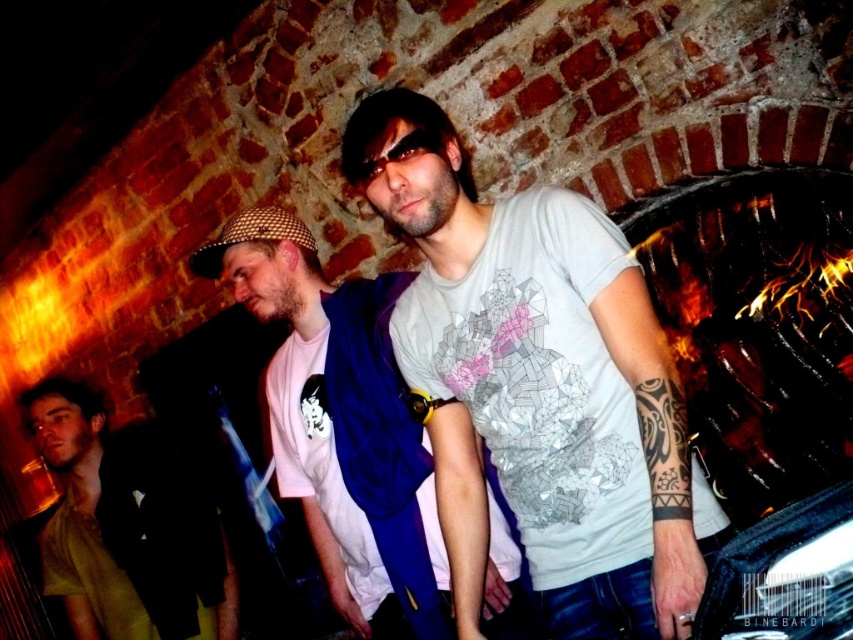
Question: Which of the following is the farthest from the observer?

Choices:
 (A) (572, 234)
 (B) (154, 476)
 (C) (354, 468)

Answer: (B)

Question: Considering the relative positions of white printed t-shirt at center and green matte shirt at lower left in the image provided, where is white printed t-shirt at center located with respect to green matte shirt at lower left?

Choices:
 (A) below
 (B) above

Answer: (B)

Question: Is white matte t-shirt at center thinner than green matte shirt at lower left?

Choices:
 (A) no
 (B) yes

Answer: (B)

Question: Which of these objects is positioned closest to the white printed t-shirt at center?

Choices:
 (A) green matte shirt at lower left
 (B) white matte t-shirt at center

Answer: (B)

Question: Does white matte t-shirt at center appear on the right side of white printed t-shirt at center?

Choices:
 (A) no
 (B) yes

Answer: (B)

Question: Considering the real-world distances, which object is closest to the white matte t-shirt at center?

Choices:
 (A) white printed t-shirt at center
 (B) green matte shirt at lower left

Answer: (A)